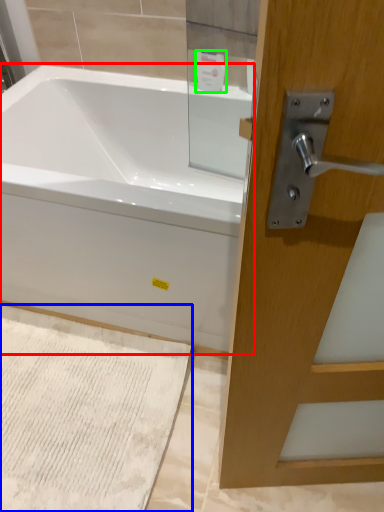
Question: Which object is the farthest from bathtub (highlighted by a red box)? Choose among these: bath mat (highlighted by a blue box) or toiletry (highlighted by a green box).

Choices:
 (A) bath mat
 (B) toiletry

Answer: (B)